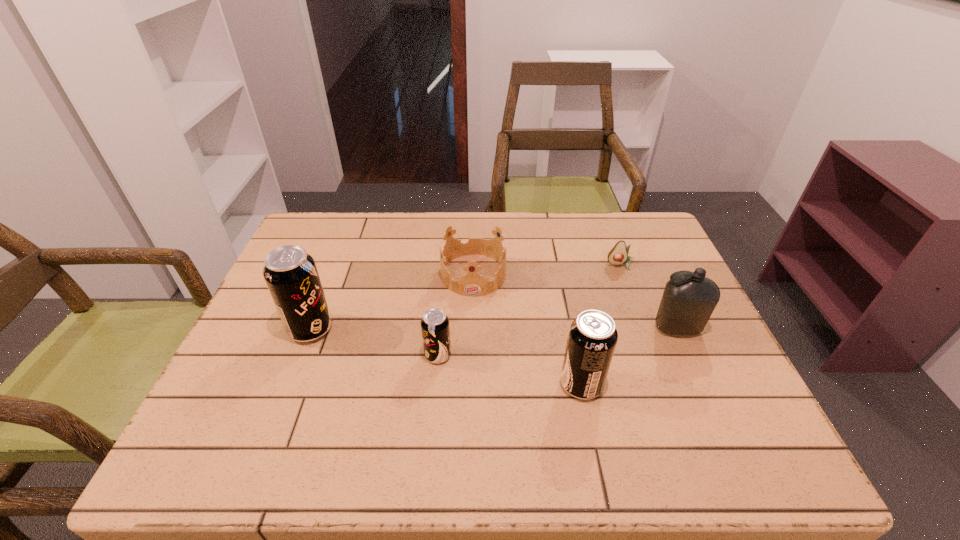
Where is `blank space at the left edge`? The width and height of the screenshot is (960, 540). blank space at the left edge is located at coordinates (262, 310).

In the image, there is a desktop. Where is `free region at the right edge`? free region at the right edge is located at coordinates (693, 384).

I want to click on free space at the near left corner, so click(x=236, y=394).

The width and height of the screenshot is (960, 540). In the image, there is a desktop. Identify the location of free space at the far right corner. (665, 240).

I want to click on unoccupied position between the shortest object and the leftmost object, so click(466, 297).

Find the location of a particular element. empty space that is in between the shortest soda can and the tiara is located at coordinates 456,314.

What are the coordinates of `vacant point located between the nearest soda can and the tiara` in the screenshot? It's located at (527, 329).

Identify the location of free space between the second soda can from left to right and the shortest object. The image size is (960, 540). (529, 310).

You are a GUI agent. You are given a task and a screenshot of the screen. Output one action in this format:
    pyautogui.click(x=<x>, y=<y>)
    Task: Click on the free space between the third object from right to left and the bottle
    The height and width of the screenshot is (540, 960).
    Given the screenshot: What is the action you would take?
    pyautogui.click(x=629, y=356)

Identify the location of free area in between the bottle and the second soda can from left to right. (558, 341).